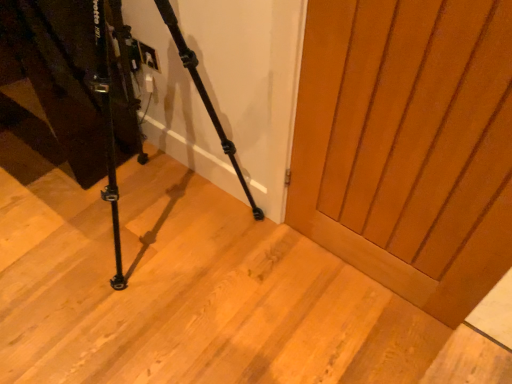
The height and width of the screenshot is (384, 512). In order to click on vacant space in between matte wood door at center and black matte tripod at lower left in this screenshot , I will do (295, 301).